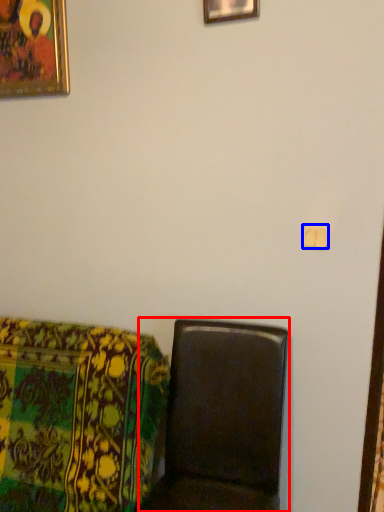
Question: Which of the following is the farthest to the observer, furniture (highlighted by a red box) or light switch (highlighted by a blue box)?

Choices:
 (A) furniture
 (B) light switch

Answer: (B)